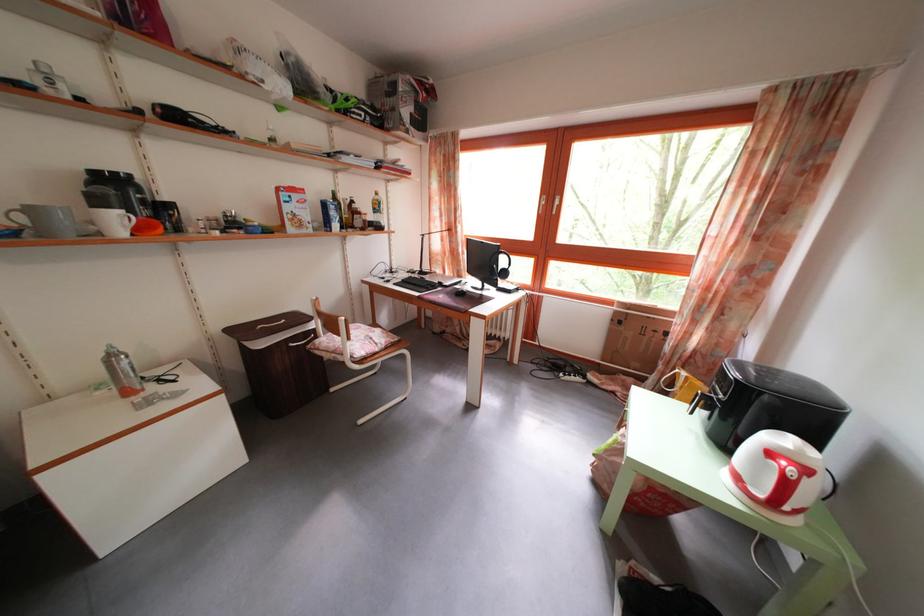
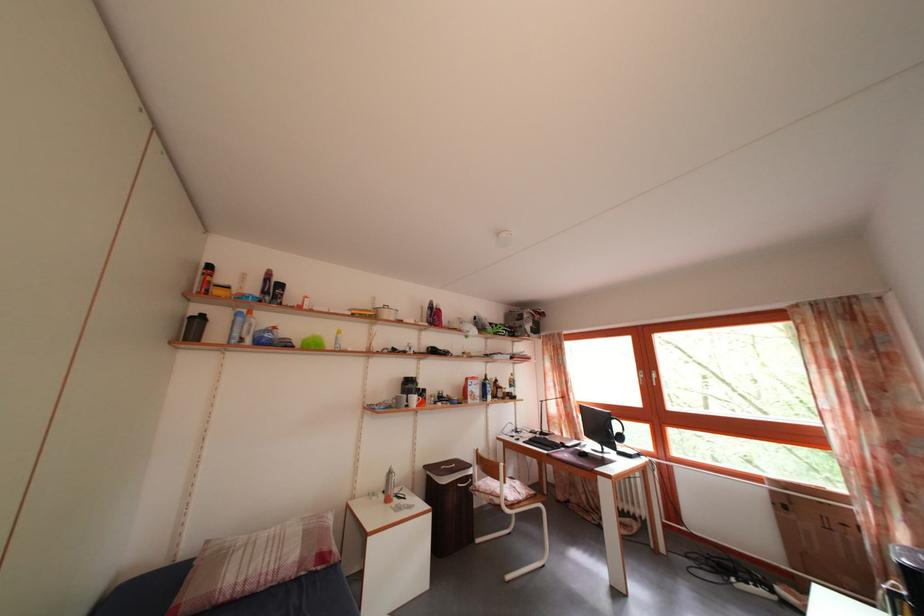
Find the pixel in the second image that matches point (304, 326) in the first image.

(468, 472)